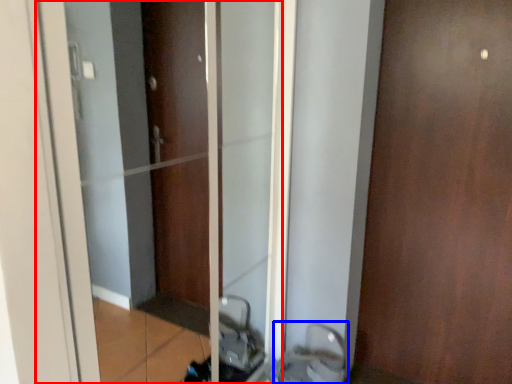
Question: Which object appears closest to the camera in this image, elevator (highlighted by a red box) or sink (highlighted by a blue box)?

Choices:
 (A) elevator
 (B) sink

Answer: (A)